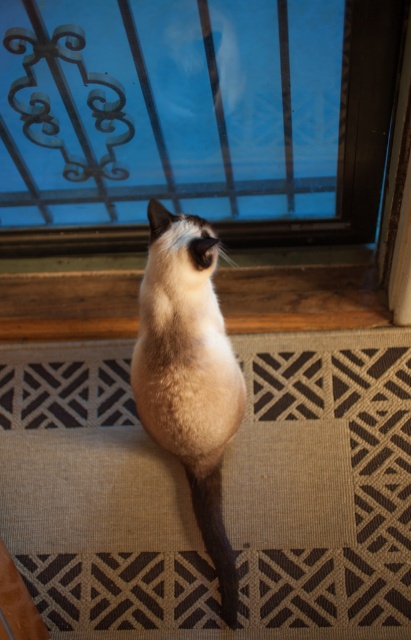
Between beige carpet at lower center and siamese fur cat at center, which one has less height?

beige carpet at lower center is shorter.

Find the location of a particular element. Image resolution: width=411 pixels, height=640 pixels. beige carpet at lower center is located at coordinates (323, 483).

Locate an element on the screen. The height and width of the screenshot is (640, 411). beige carpet at lower center is located at coordinates (323, 483).

Does point (302, 364) come closer to viewer compared to point (62, 204)?

Yes, it is in front of point (62, 204).

The height and width of the screenshot is (640, 411). Identify the location of beige carpet at lower center. (323, 483).

Who is shorter, transparent glass window at upper center or siamese fur cat at center?

With less height is transparent glass window at upper center.

Is point (177, 195) positioned behind point (187, 410)?

Yes, it is behind point (187, 410).

Identify the location of transparent glass window at upper center. This screenshot has height=640, width=411. (193, 118).